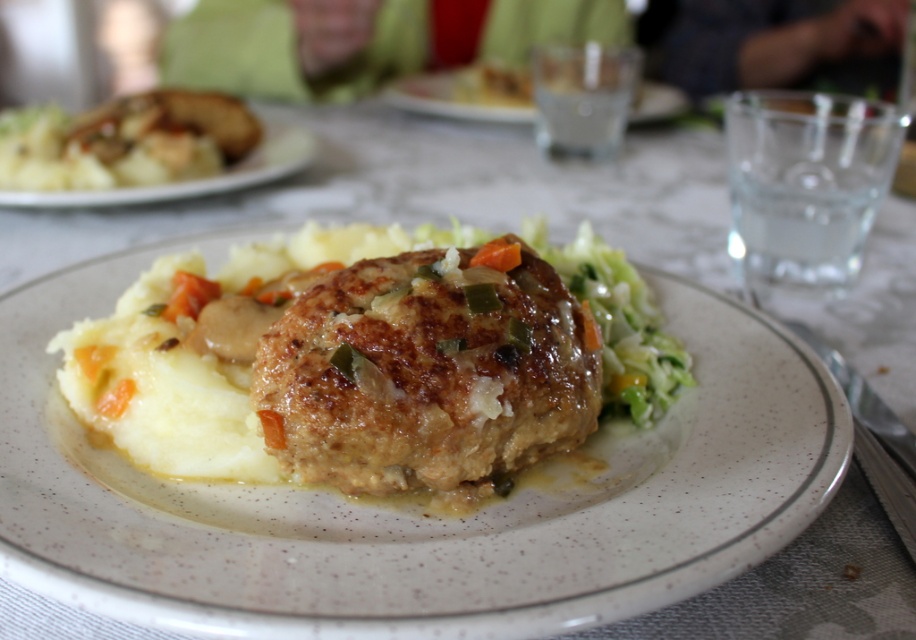
Is golden-brown meatloaf at center to the right of matte brown mashed potatoes at upper left from the viewer's perspective?

Yes, golden-brown meatloaf at center is to the right of matte brown mashed potatoes at upper left.

Is point (800, 364) positioned behind point (180, 138)?

No, (800, 364) is in front of (180, 138).

Between point (622, 502) and point (56, 147), which one is positioned in front?

Point (622, 502) is more forward.

You are a GUI agent. You are given a task and a screenshot of the screen. Output one action in this format:
    pyautogui.click(x=<x>, y=<y>)
    Task: Click on the golden-brown meatloaf at center
    Image resolution: width=916 pixels, height=640 pixels.
    Given the screenshot: What is the action you would take?
    pyautogui.click(x=418, y=506)

Does brown textured meatloaf at center appear over matte brown mashed potatoes at upper left?

No, brown textured meatloaf at center is not above matte brown mashed potatoes at upper left.

What do you see at coordinates (427, 371) in the screenshot?
I see `brown textured meatloaf at center` at bounding box center [427, 371].

At what (x,y) coordinates should I click in order to perform the action: click on brown textured meatloaf at center. Please return your answer as a coordinate pair (x, y). Looking at the image, I should click on (427, 371).

Does point (40, 452) lie in front of point (465, 276)?

Yes, it is in front of point (465, 276).

Who is lower down, golden-brown meatloaf at center or brown textured meatloaf at center?

golden-brown meatloaf at center is lower down.

Which is in front, point (682, 304) or point (426, 291)?

Positioned in front is point (426, 291).

Identify the location of golden-brown meatloaf at center. (418, 506).